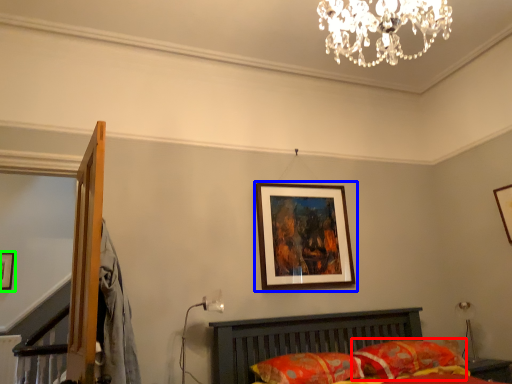
Question: Estimate the real-world distances between objects in this image. Which object is closer to pillow (highlighted by a red box), picture frame (highlighted by a blue box) or picture frame (highlighted by a green box)?

Choices:
 (A) picture frame
 (B) picture frame

Answer: (A)